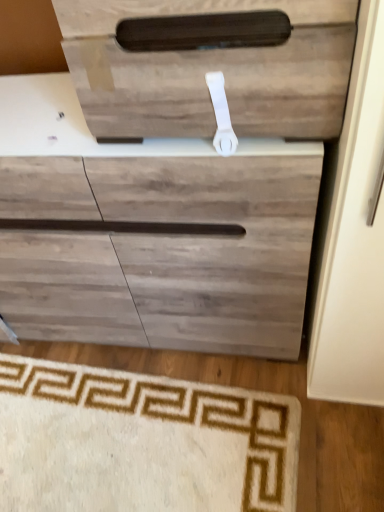
Question: Does wooden drawer at upper center appear on the left side of beige carpet at lower left?

Choices:
 (A) yes
 (B) no

Answer: (B)

Question: Are wooden drawer at upper center and beige carpet at lower left far apart?

Choices:
 (A) yes
 (B) no

Answer: (B)

Question: Is wooden drawer at upper center aimed at beige carpet at lower left?

Choices:
 (A) yes
 (B) no

Answer: (B)

Question: Is wooden drawer at upper center positioned with its back to beige carpet at lower left?

Choices:
 (A) no
 (B) yes

Answer: (A)

Question: Is wooden drawer at upper center taller than beige carpet at lower left?

Choices:
 (A) yes
 (B) no

Answer: (A)

Question: Visually, is beige carpet at lower left positioned to the left or to the right of white plastic door handle at upper center?

Choices:
 (A) right
 (B) left

Answer: (B)

Question: From the image's perspective, is beige carpet at lower left above or below white plastic door handle at upper center?

Choices:
 (A) below
 (B) above

Answer: (A)

Question: Is beige carpet at lower left spatially inside white plastic door handle at upper center, or outside of it?

Choices:
 (A) inside
 (B) outside

Answer: (B)

Question: From their relative heights in the image, would you say beige carpet at lower left is taller or shorter than white plastic door handle at upper center?

Choices:
 (A) short
 (B) tall

Answer: (A)

Question: Which is correct: white plastic door handle at upper center is inside wooden drawer at upper center, or outside of it?

Choices:
 (A) inside
 (B) outside

Answer: (A)

Question: Relative to wooden drawer at upper center, is white plastic door handle at upper center in front or behind?

Choices:
 (A) front
 (B) behind

Answer: (B)

Question: From a real-world perspective, is white plastic door handle at upper center positioned above or below wooden drawer at upper center?

Choices:
 (A) above
 (B) below

Answer: (B)

Question: Visually, is white plastic door handle at upper center positioned to the left or to the right of wooden drawer at upper center?

Choices:
 (A) left
 (B) right

Answer: (B)

Question: Is beige carpet at lower left to the left or to the right of wooden drawer at upper center in the image?

Choices:
 (A) right
 (B) left

Answer: (B)

Question: From a real-world perspective, relative to wooden drawer at upper center, is beige carpet at lower left vertically above or below?

Choices:
 (A) below
 (B) above

Answer: (A)